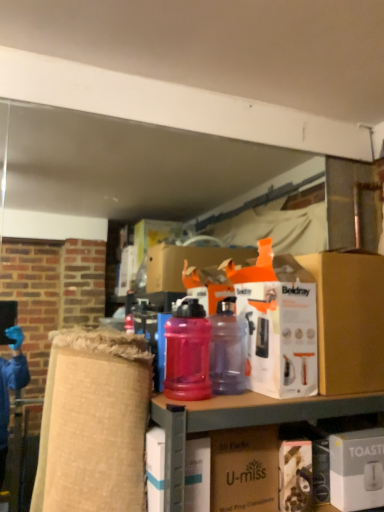
Question: From the image's perspective, relative to white cardboard box at center, arranged as the 3th box when viewed from the right, is translucent plastic water bottle at center, the 2th bottle when ordered from right to left, above or below?

Choices:
 (A) above
 (B) below

Answer: (A)

Question: From a real-world perspective, relative to white cardboard box at center, arranged as the 3th box when viewed from the right, is translucent plastic water bottle at center, the 2th bottle when ordered from right to left, vertically above or below?

Choices:
 (A) above
 (B) below

Answer: (A)

Question: Which is nearer to the translucent plastic water bottle at center, the 2th bottle when ordered from right to left?

Choices:
 (A) translucent plastic bottles at center
 (B) matte brown cardboard box at center
 (C) white cardboard box at center, which is the first box from left to right
 (D) white matte toaster at lower right, the third box positioned from the left
 (E) orange cardboard box at center, the second box viewed from the left

Answer: (A)

Question: Which is farther from the white matte toaster at lower right, which is the first box from right to left?

Choices:
 (A) orange cardboard box at center, the 2th box when ordered from right to left
 (B) translucent plastic bottles at center
 (C) white cardboard box at center, which is the first box from left to right
 (D) matte brown cardboard box at center
 (E) translucent purple water bottle at center, the 2th bottle when ordered from left to right

Answer: (C)